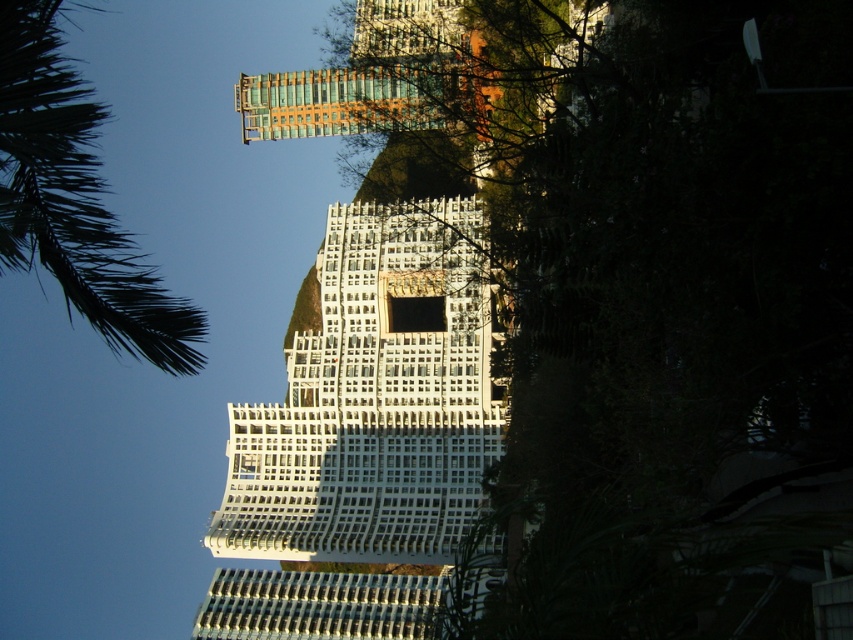
Question: Is green leafy tree at center closer to the viewer compared to green leafy palm tree at upper left?

Choices:
 (A) no
 (B) yes

Answer: (B)

Question: In this image, where is green leafy tree at center located relative to green leafy palm tree at upper left?

Choices:
 (A) right
 (B) left

Answer: (A)

Question: Estimate the real-world distances between objects in this image. Which object is closer to the white glass building at center?

Choices:
 (A) green leafy palm tree at upper left
 (B) green leafy tree at center

Answer: (B)

Question: Among these objects, which one is farthest from the camera?

Choices:
 (A) white glass building at center
 (B) green leafy tree at center

Answer: (A)

Question: Based on their relative distances, which object is farther from the white glass building at center?

Choices:
 (A) green leafy tree at center
 (B) green leafy palm tree at upper left

Answer: (B)

Question: Does green leafy tree at center have a larger size compared to green leafy palm tree at upper left?

Choices:
 (A) yes
 (B) no

Answer: (A)